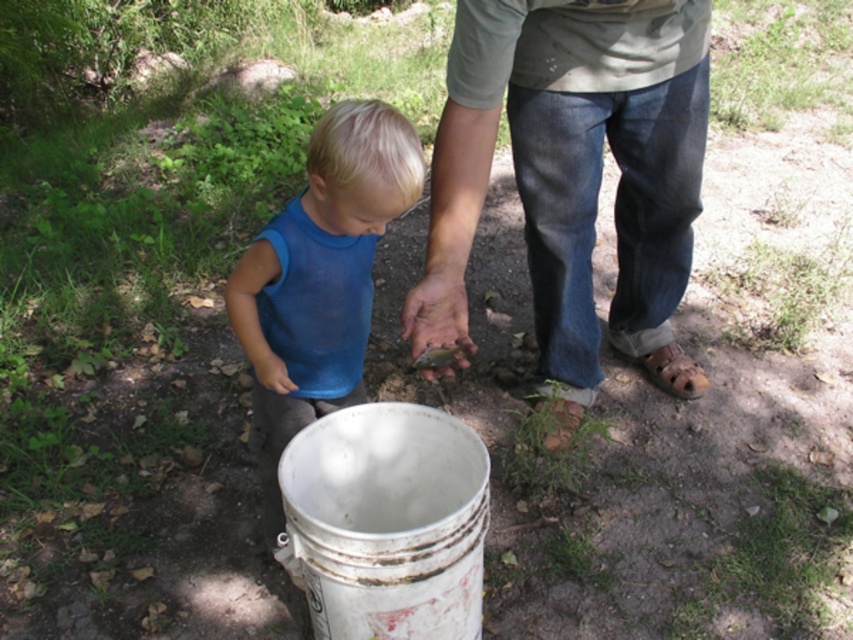
You are standing at the point labeled point [456,29] and want to walk to the point labeled point [285,296]. Which direction should you move to get closer to your destination?

You should move towards the direction away from the viewer since point [285,296] is further from the viewer compared to your current position at point [456,29].

You are standing in the outdoor scene and need to determine which clothing item is taller between the denim jeans at center and the blue mesh shirt at center. Based on the scene description, which one is taller?

The denim jeans at center is taller than the blue mesh shirt at center according to the description.